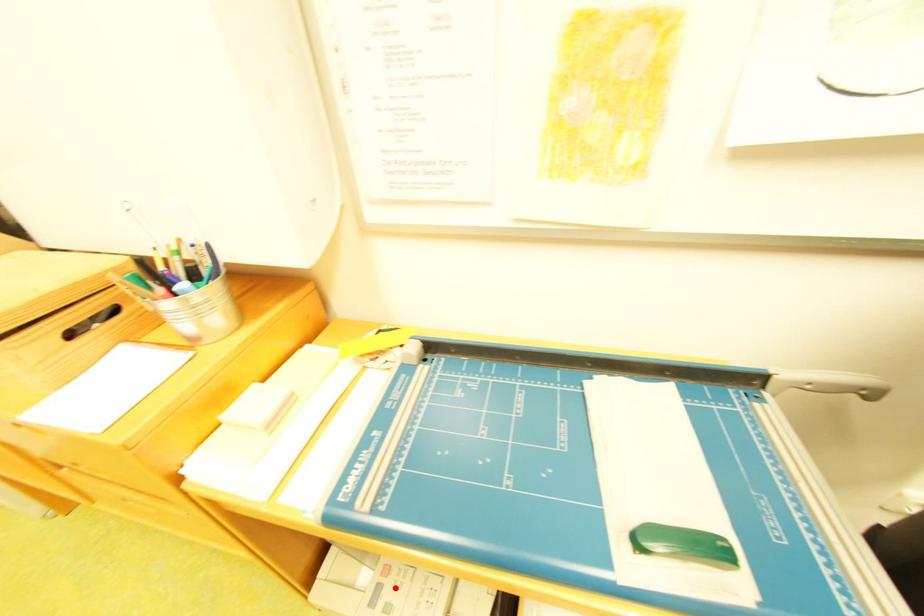
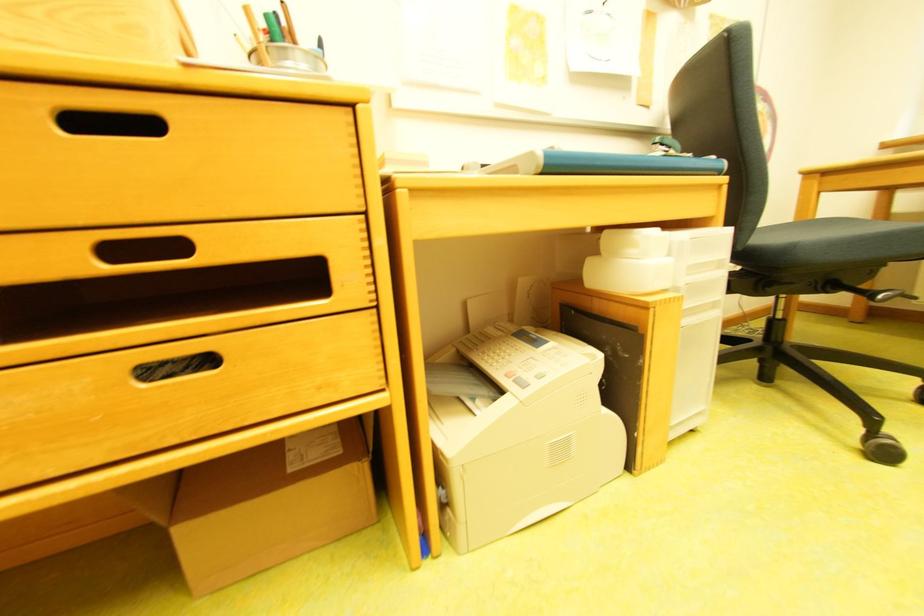
Locate, in the second image, the point that corresponds to the highlighted location in the first image.

(531, 378)